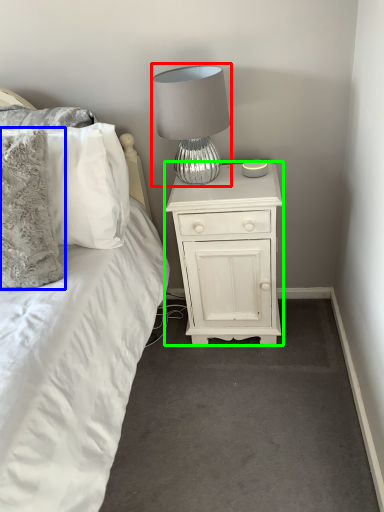
Question: Which object is the farthest from lamp (highlighted by a red box)? Choose among these: pillow (highlighted by a blue box) or nightstand (highlighted by a green box).

Choices:
 (A) pillow
 (B) nightstand

Answer: (A)